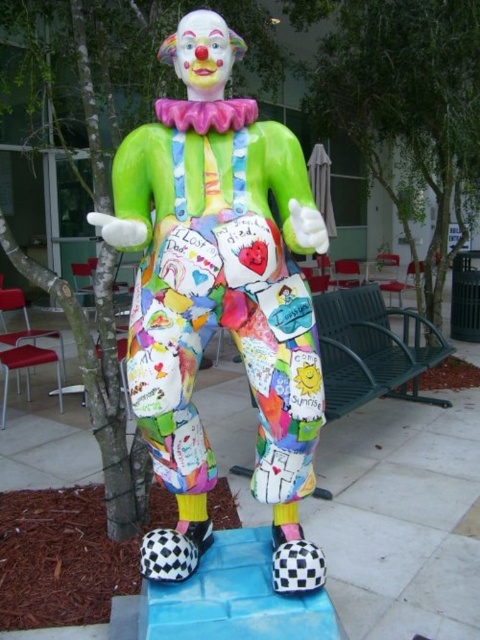
Question: Which of the following is the farthest from the observer?

Choices:
 (A) (462, 83)
 (B) (206, 452)

Answer: (A)

Question: Can you confirm if matte plastic clown at center is smaller than green leafy tree at center?

Choices:
 (A) yes
 (B) no

Answer: (A)

Question: Does matte plastic clown at center come in front of green leafy tree at center?

Choices:
 (A) yes
 (B) no

Answer: (A)

Question: Is matte plastic clown at center wider than green leafy tree at center?

Choices:
 (A) yes
 (B) no

Answer: (B)

Question: Which point is closer to the camera?

Choices:
 (A) (420, 173)
 (B) (205, 280)

Answer: (B)